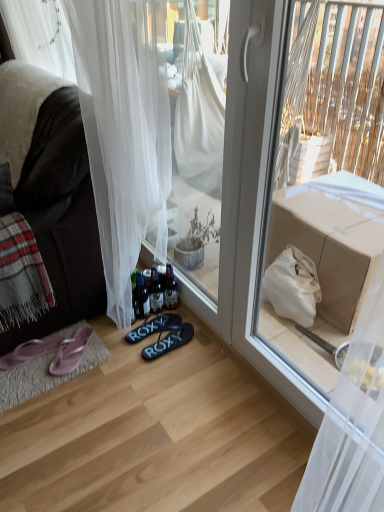
Question: Is plaid woolen blanket at left positioned beyond the bounds of matte cardboard box at upper right?

Choices:
 (A) yes
 (B) no

Answer: (A)

Question: Considering the relative sizes of plaid woolen blanket at left and matte cardboard box at upper right in the image provided, is plaid woolen blanket at left bigger than matte cardboard box at upper right?

Choices:
 (A) no
 (B) yes

Answer: (A)

Question: From a real-world perspective, is plaid woolen blanket at left positioned over matte cardboard box at upper right based on gravity?

Choices:
 (A) no
 (B) yes

Answer: (A)

Question: From the image's perspective, does plaid woolen blanket at left appear lower than matte cardboard box at upper right?

Choices:
 (A) yes
 (B) no

Answer: (B)

Question: Would you say matte cardboard box at upper right is part of plaid woolen blanket at left's contents?

Choices:
 (A) yes
 (B) no

Answer: (B)

Question: Is dark brown leather couch at left to the left or to the right of translucent glass bottles at lower center, which is the 1th bottle in left-to-right order, in the image?

Choices:
 (A) right
 (B) left

Answer: (B)

Question: Considering the positions of dark brown leather couch at left and translucent glass bottles at lower center, which is the 1th bottle in left-to-right order, in the image, is dark brown leather couch at left bigger or smaller than translucent glass bottles at lower center, which is the 1th bottle in left-to-right order,?

Choices:
 (A) small
 (B) big

Answer: (B)

Question: Is point (94, 249) positioned closer to the camera than point (142, 290)?

Choices:
 (A) farther
 (B) closer

Answer: (B)

Question: Looking at their shapes, would you say dark brown leather couch at left is wider or thinner than translucent glass bottles at lower center, which is the 1th bottle in left-to-right order?

Choices:
 (A) wide
 (B) thin

Answer: (A)

Question: Looking at the image, does black rubber flip-flops at center, which is the third footwear in left-to-right order, seem bigger or smaller compared to pink fabric flip-flops at lower left, arranged as the third footwear when viewed from the right?

Choices:
 (A) big
 (B) small

Answer: (A)

Question: Is point (135, 334) positioned closer to the camera than point (61, 362)?

Choices:
 (A) farther
 (B) closer

Answer: (A)

Question: Which is correct: black rubber flip-flops at center, the 2th footwear when ordered from right to left, is inside pink fabric flip-flops at lower left, arranged as the third footwear when viewed from the right, or outside of it?

Choices:
 (A) outside
 (B) inside

Answer: (A)

Question: From a real-world perspective, relative to pink fabric flip-flops at lower left, which is the 2th footwear in left-to-right order, is black rubber flip-flops at center, which is the third footwear in left-to-right order, vertically above or below?

Choices:
 (A) below
 (B) above

Answer: (A)

Question: Visually, is plaid woolen blanket at left positioned to the left or to the right of translucent glass bottles at lower center, which appears as the 2th bottle when viewed from the right?

Choices:
 (A) right
 (B) left

Answer: (B)

Question: Is point (1, 234) positioned closer to the camera than point (132, 292)?

Choices:
 (A) closer
 (B) farther

Answer: (A)